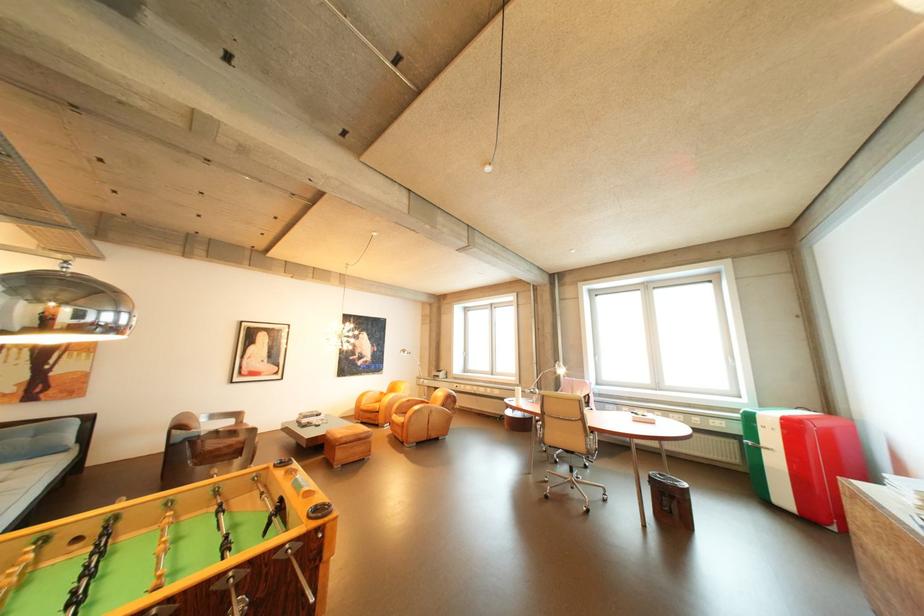
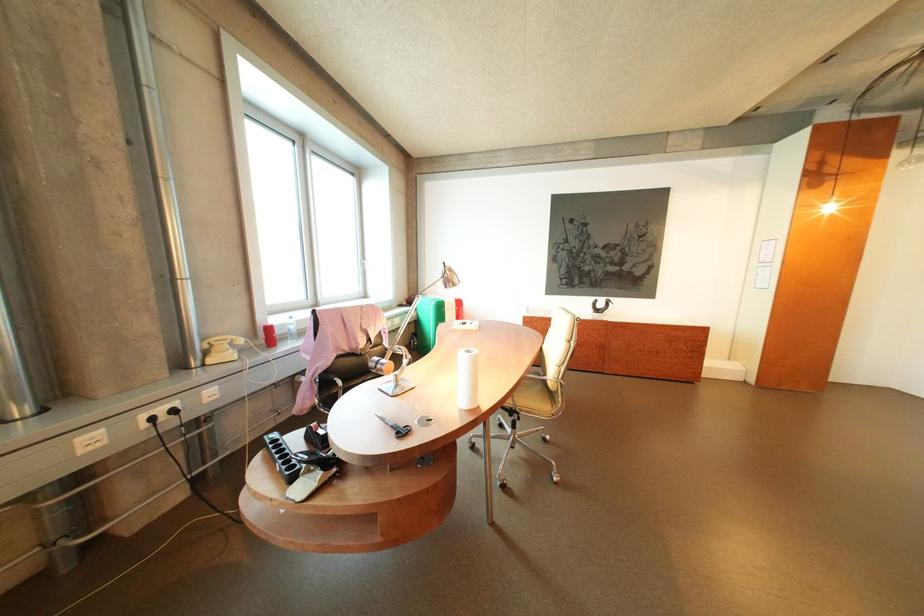
Question: I am providing you with two images of the same scene from different viewpoints. After the viewpoint changes to image2, which objects are now occluded?

Choices:
 (A) paper towel roll
 (B) black bin lid
 (C) red cylinder canister
 (D) brown trash can

Answer: (D)